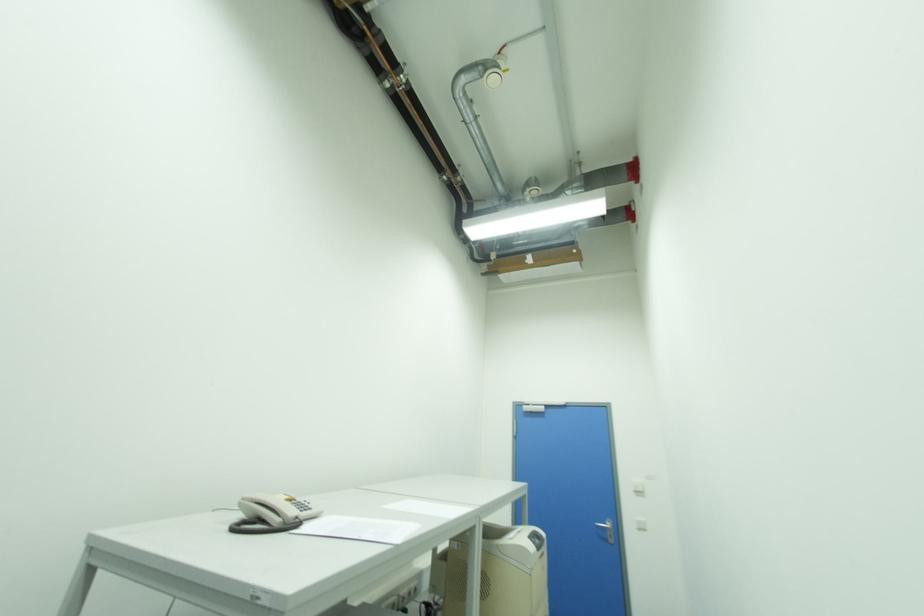
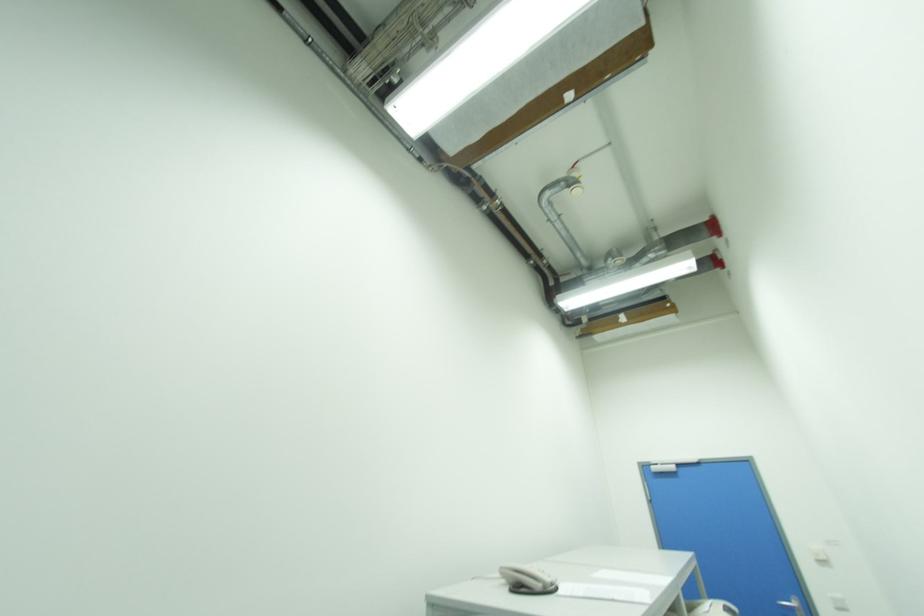
The images are taken continuously from a first-person perspective. In which direction are you moving?

The movement direction of the cameraman is left, backward.